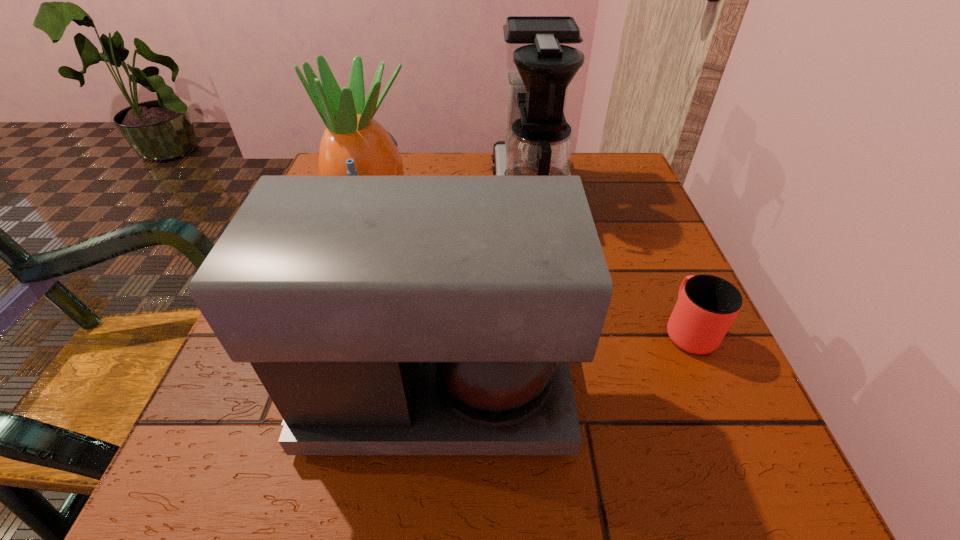
Identify the location of object located in the near left corner section of the desktop. (384, 314).

The image size is (960, 540). In the image, there is a desktop. Identify the location of free space at the far edge. (480, 170).

You are a GUI agent. You are given a task and a screenshot of the screen. Output one action in this format:
    pyautogui.click(x=<x>, y=<y>)
    Task: Click on the vacant space at the near edge of the desktop
    The height and width of the screenshot is (540, 960).
    Given the screenshot: What is the action you would take?
    pyautogui.click(x=330, y=494)

Locate an element on the screen. The height and width of the screenshot is (540, 960). vacant region at the right edge of the desktop is located at coordinates (640, 223).

In the image, there is a desktop. Find the location of `vacant space at the near left corner`. vacant space at the near left corner is located at coordinates point(272,477).

Where is `vacant space at the far right corner`? vacant space at the far right corner is located at coordinates (628, 201).

You are a GUI agent. You are given a task and a screenshot of the screen. Output one action in this format:
    pyautogui.click(x=<x>, y=<y>)
    Task: Click on the vacant space that is in between the farther coffee maker and the cup
    The width and height of the screenshot is (960, 540).
    Given the screenshot: What is the action you would take?
    pyautogui.click(x=609, y=260)

Locate which object is the third closest to the pineapple. Please provide its 2D coordinates. Your answer should be formatted as a tuple, i.e. [(x, y)], where the tuple contains the x and y coordinates of a point satisfying the conditions above.

[(707, 305)]

Find the location of a particular element. object that ranks as the closest to the farther coffee maker is located at coordinates (354, 143).

Where is `vacant region that satisfies the following two spatial constraints: 1. at the front of the farther coffee maker where the controls are located; 2. on the handle side of the shortest object`? Image resolution: width=960 pixels, height=540 pixels. vacant region that satisfies the following two spatial constraints: 1. at the front of the farther coffee maker where the controls are located; 2. on the handle side of the shortest object is located at coordinates (551, 329).